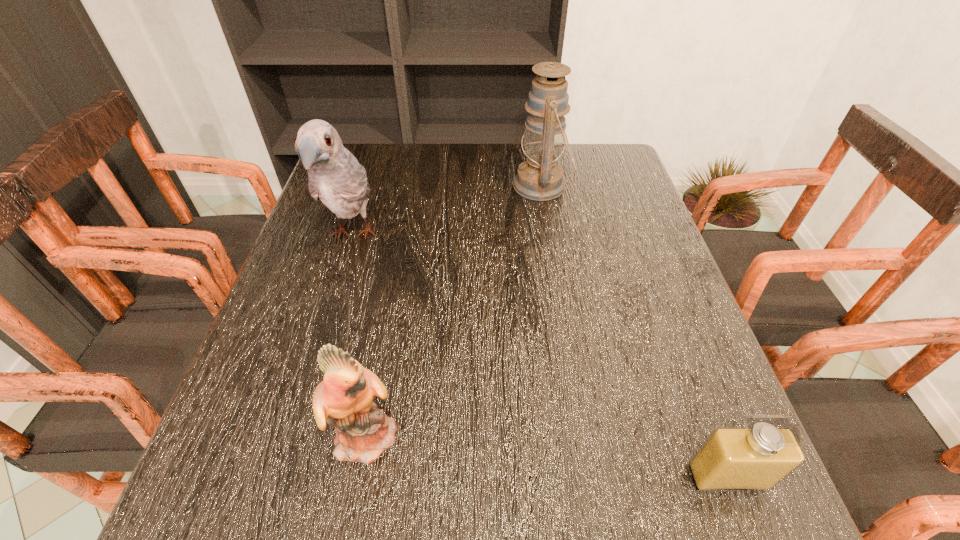
I want to click on free location at the far left corner, so click(379, 144).

The width and height of the screenshot is (960, 540). In order to click on vacant space at the far right corner in this screenshot , I will do `click(620, 179)`.

Where is `vacant area that lies between the nearer parrot and the oil lamp`? The image size is (960, 540). vacant area that lies between the nearer parrot and the oil lamp is located at coordinates (455, 310).

The height and width of the screenshot is (540, 960). I want to click on free spot between the second object from right to left and the farther parrot, so click(x=447, y=211).

Identify the location of free space that is in between the third object from right to left and the oil lamp. (455, 310).

The height and width of the screenshot is (540, 960). I want to click on vacant area between the nearer parrot and the perfume, so (548, 455).

This screenshot has width=960, height=540. What are the coordinates of `free space between the nearer parrot and the leftmost object` in the screenshot? It's located at (361, 335).

In order to click on free area in between the left parrot and the second object from right to left in this screenshot , I will do `click(447, 211)`.

Where is `unoccupied position between the left parrot and the shorter parrot`? This screenshot has width=960, height=540. unoccupied position between the left parrot and the shorter parrot is located at coordinates (361, 335).

At what (x,y) coordinates should I click in order to perform the action: click on blank region between the shortest object and the oil lamp. Please return your answer as a coordinate pair (x, y). The width and height of the screenshot is (960, 540). Looking at the image, I should click on (635, 332).